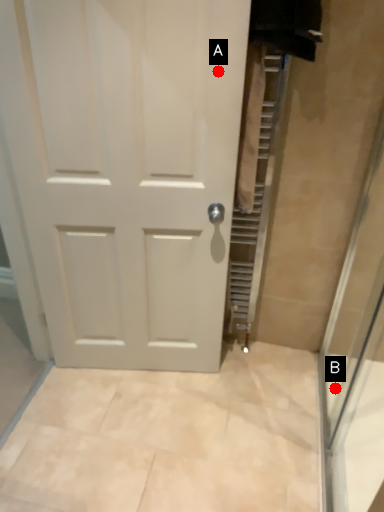
Question: Two points are circled on the image, labeled by A and B beside each circle. Which point is farther from the camera taking this photo?

Choices:
 (A) A is further
 (B) B is further

Answer: (B)